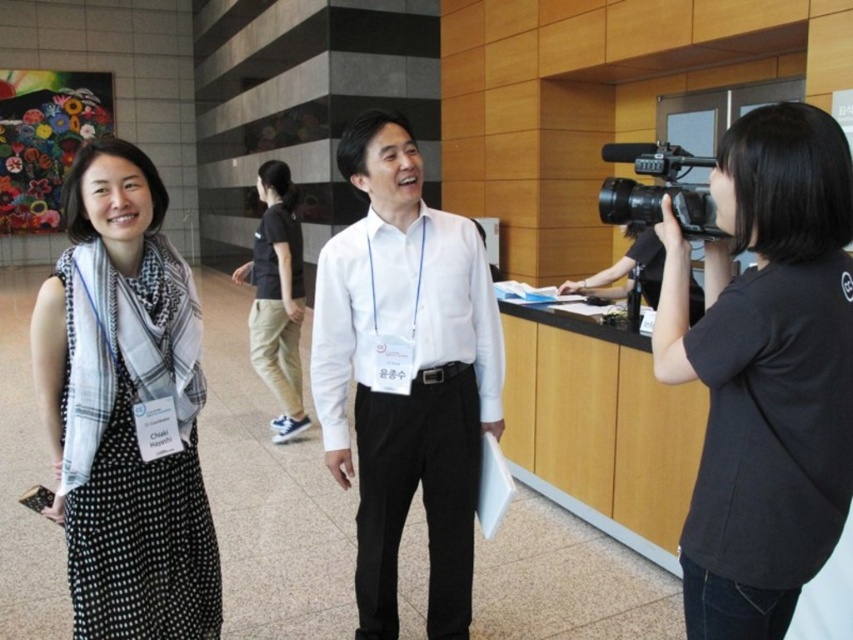
Which of these two, black cotton pants at center or black plastic video camera at right, stands taller?

black cotton pants at center is taller.

Does black cotton pants at center have a lesser height compared to black plastic video camera at right?

In fact, black cotton pants at center may be taller than black plastic video camera at right.

The width and height of the screenshot is (853, 640). In order to click on black cotton pants at center in this screenshot , I will do `click(277, 298)`.

Where is `black cotton pants at center`? The image size is (853, 640). black cotton pants at center is located at coordinates (277, 298).

What do you see at coordinates (764, 371) in the screenshot?
I see `black matte camera at right` at bounding box center [764, 371].

Which is below, black matte camera at right or white glossy shirt at center?

white glossy shirt at center is below.

Who is more distant from viewer, (x=840, y=140) or (x=387, y=525)?

The point (x=387, y=525) is more distant.

Where is `black matte camera at right`? black matte camera at right is located at coordinates (764, 371).

This screenshot has height=640, width=853. I want to click on black matte camera at right, so click(x=764, y=371).

Can you confirm if black matte camera at right is taller than black plastic video camera at right?

Yes, black matte camera at right is taller than black plastic video camera at right.

The height and width of the screenshot is (640, 853). What do you see at coordinates (764, 371) in the screenshot?
I see `black matte camera at right` at bounding box center [764, 371].

Locate an element on the screen. This screenshot has width=853, height=640. black matte camera at right is located at coordinates (764, 371).